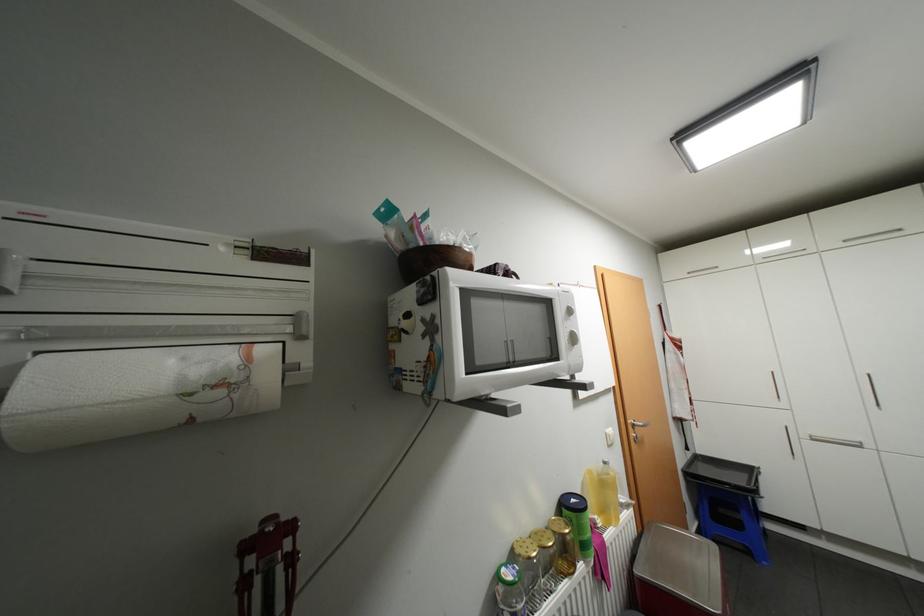
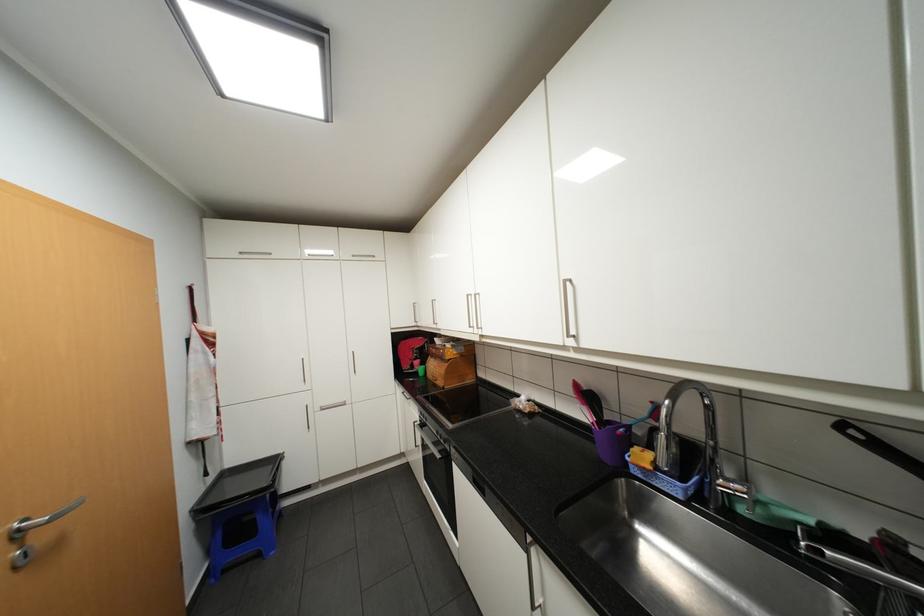
Question: The camera is either moving clockwise (left) or counter-clockwise (right) around the object. The first image is from the beginning of the video and the second image is from the end. Is the camera moving left or right when shooting the video?

Choices:
 (A) Left
 (B) Right

Answer: (A)